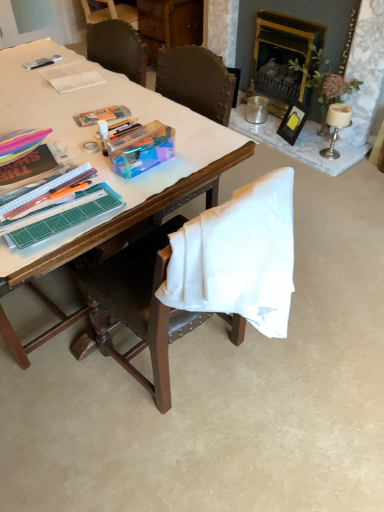
Question: From a real-world perspective, is metallic silver pen at upper left on top of black wood picture frame at upper right?

Choices:
 (A) no
 (B) yes

Answer: (B)

Question: Considering the relative sizes of metallic silver pen at upper left and black wood picture frame at upper right in the image provided, is metallic silver pen at upper left shorter than black wood picture frame at upper right?

Choices:
 (A) yes
 (B) no

Answer: (A)

Question: From the image's perspective, is metallic silver pen at upper left located above black wood picture frame at upper right?

Choices:
 (A) yes
 (B) no

Answer: (A)

Question: Is metallic silver pen at upper left far away from black wood picture frame at upper right?

Choices:
 (A) yes
 (B) no

Answer: (A)

Question: From a real-world perspective, is metallic silver pen at upper left positioned under black wood picture frame at upper right based on gravity?

Choices:
 (A) yes
 (B) no

Answer: (B)

Question: Does metallic silver pen at upper left have a larger size compared to black wood picture frame at upper right?

Choices:
 (A) no
 (B) yes

Answer: (A)

Question: From the image's perspective, does metallic silver pen at upper left appear lower than gold-framed fireplace at upper right?

Choices:
 (A) no
 (B) yes

Answer: (B)

Question: From a real-world perspective, is metallic silver pen at upper left below gold-framed fireplace at upper right?

Choices:
 (A) yes
 (B) no

Answer: (B)

Question: Considering the relative sizes of metallic silver pen at upper left and gold-framed fireplace at upper right in the image provided, is metallic silver pen at upper left wider than gold-framed fireplace at upper right?

Choices:
 (A) no
 (B) yes

Answer: (B)

Question: Is metallic silver pen at upper left not inside gold-framed fireplace at upper right?

Choices:
 (A) yes
 (B) no

Answer: (A)

Question: Would you say metallic silver pen at upper left contains gold-framed fireplace at upper right?

Choices:
 (A) no
 (B) yes

Answer: (A)

Question: From a real-world perspective, does metallic silver pen at upper left stand above gold-framed fireplace at upper right?

Choices:
 (A) yes
 (B) no

Answer: (A)

Question: From the image's perspective, is wooden chair at center beneath white paper at upper left?

Choices:
 (A) no
 (B) yes

Answer: (B)